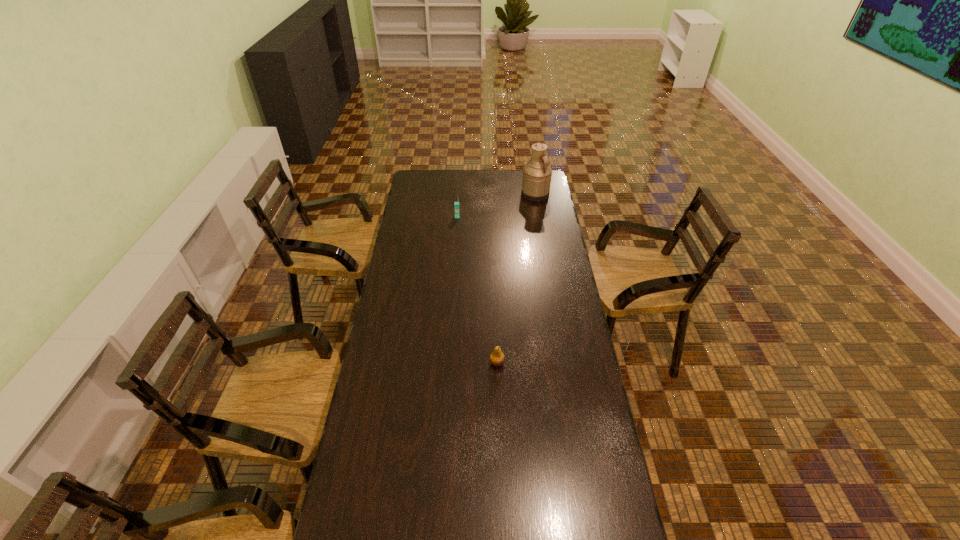
Identify the location of free space between the nearest object and the cellular telephone. (477, 289).

Where is `free space between the second object from right to left and the cellular telephone`? This screenshot has width=960, height=540. free space between the second object from right to left and the cellular telephone is located at coordinates (x=477, y=289).

Locate an element on the screen. object that is the closest to the nearest object is located at coordinates (456, 204).

Where is `the second closest object to the pear`? This screenshot has height=540, width=960. the second closest object to the pear is located at coordinates (537, 173).

You are a GUI agent. You are given a task and a screenshot of the screen. Output one action in this format:
    pyautogui.click(x=<x>, y=<y>)
    Task: Click on the vacant position in the image that satisfies the following two spatial constraints: 1. on the keypad of the second farthest object; 2. on the right side of the nearest object
    
    Given the screenshot: What is the action you would take?
    pyautogui.click(x=447, y=362)

Locate an element on the screen. The image size is (960, 540). blank area in the image that satisfies the following two spatial constraints: 1. on the keypad of the cellular telephone; 2. on the right side of the nearest object is located at coordinates (447, 362).

I want to click on free space that satisfies the following two spatial constraints: 1. on the keypad of the second object from right to left; 2. on the left side of the leftmost object, so click(x=447, y=362).